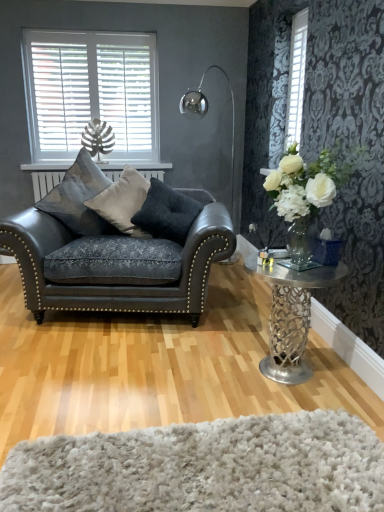
Question: Are white textured blinds at upper right, which is counted as the 1th window, starting from the front, and polished metal floor lamp at upper center making contact?

Choices:
 (A) yes
 (B) no

Answer: (B)

Question: Is white textured blinds at upper right, which appears as the second window when viewed from the back, at the left side of polished metal floor lamp at upper center?

Choices:
 (A) yes
 (B) no

Answer: (B)

Question: Is white textured blinds at upper right, which appears as the second window when viewed from the back, further to the viewer compared to polished metal floor lamp at upper center?

Choices:
 (A) no
 (B) yes

Answer: (A)

Question: Does white textured blinds at upper right, arranged as the first window when viewed from the right, turn towards polished metal floor lamp at upper center?

Choices:
 (A) no
 (B) yes

Answer: (A)

Question: From a real-world perspective, is white textured blinds at upper right, which appears as the second window when viewed from the back, on top of polished metal floor lamp at upper center?

Choices:
 (A) yes
 (B) no

Answer: (A)

Question: From a real-world perspective, is suede-like gray pillow at center, the 2th pillow from the left, physically located above or below white shaggy rug at lower center?

Choices:
 (A) below
 (B) above

Answer: (B)

Question: In terms of width, does suede-like gray pillow at center, the 2th pillow from the left, look wider or thinner when compared to white shaggy rug at lower center?

Choices:
 (A) wide
 (B) thin

Answer: (B)

Question: Relative to white shaggy rug at lower center, is suede-like gray pillow at center, the 2th pillow in the right-to-left sequence, in front or behind?

Choices:
 (A) front
 (B) behind

Answer: (B)

Question: Based on their positions, is suede-like gray pillow at center, the 2th pillow in the right-to-left sequence, located to the left or right of white shaggy rug at lower center?

Choices:
 (A) left
 (B) right

Answer: (A)

Question: Considering the positions of white glass vase at right and metallic silver table at right in the image, is white glass vase at right wider or thinner than metallic silver table at right?

Choices:
 (A) thin
 (B) wide

Answer: (A)

Question: Is white glass vase at right spatially inside metallic silver table at right, or outside of it?

Choices:
 (A) inside
 (B) outside

Answer: (B)

Question: From a real-world perspective, is white glass vase at right above or below metallic silver table at right?

Choices:
 (A) below
 (B) above

Answer: (B)

Question: From their relative heights in the image, would you say white glass vase at right is taller or shorter than metallic silver table at right?

Choices:
 (A) tall
 (B) short

Answer: (B)

Question: From the image's perspective, is metallic silver table at right positioned above or below polished metal floor lamp at upper center?

Choices:
 (A) above
 (B) below

Answer: (B)

Question: From a real-world perspective, is metallic silver table at right above or below polished metal floor lamp at upper center?

Choices:
 (A) above
 (B) below

Answer: (B)